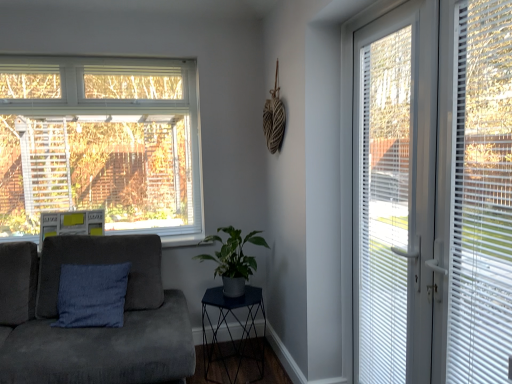
Question: Considering the relative positions of metallic dark blue side table at center and suede couch at left in the image provided, is metallic dark blue side table at center to the right of suede couch at left from the viewer's perspective?

Choices:
 (A) yes
 (B) no

Answer: (A)

Question: Does metallic dark blue side table at center have a smaller size compared to suede couch at left?

Choices:
 (A) yes
 (B) no

Answer: (A)

Question: From the image's perspective, is metallic dark blue side table at center over suede couch at left?

Choices:
 (A) no
 (B) yes

Answer: (A)

Question: Is metallic dark blue side table at center placed right next to suede couch at left?

Choices:
 (A) no
 (B) yes

Answer: (A)

Question: Can you confirm if metallic dark blue side table at center is bigger than suede couch at left?

Choices:
 (A) yes
 (B) no

Answer: (B)

Question: Considering the relative positions of metallic dark blue side table at center and suede couch at left in the image provided, is metallic dark blue side table at center behind suede couch at left?

Choices:
 (A) yes
 (B) no

Answer: (A)

Question: Is white plastic door at right wider than blue fabric cushion at left?

Choices:
 (A) yes
 (B) no

Answer: (B)

Question: From a real-world perspective, does white plastic door at right sit lower than blue fabric cushion at left?

Choices:
 (A) yes
 (B) no

Answer: (B)

Question: Does white plastic door at right come in front of blue fabric cushion at left?

Choices:
 (A) no
 (B) yes

Answer: (B)

Question: Would you consider white plastic door at right to be distant from blue fabric cushion at left?

Choices:
 (A) yes
 (B) no

Answer: (A)

Question: Is white plastic door at right positioned with its back to blue fabric cushion at left?

Choices:
 (A) no
 (B) yes

Answer: (A)

Question: From the image's perspective, is white plastic door at right over blue fabric cushion at left?

Choices:
 (A) no
 (B) yes

Answer: (B)

Question: Is blue fabric cushion at left not close to metallic dark blue side table at center?

Choices:
 (A) no
 (B) yes

Answer: (A)